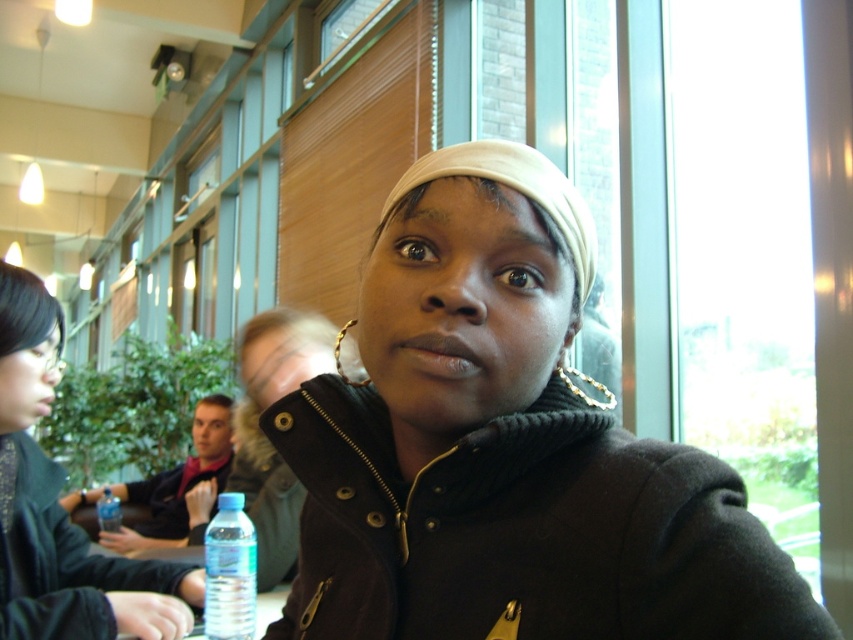
Question: Can you confirm if blue plastic water bottle at lower left is thinner than transparent plastic bottle at lower left?

Choices:
 (A) no
 (B) yes

Answer: (A)

Question: Which point is farther from the camera taking this photo?

Choices:
 (A) (30, 276)
 (B) (102, 518)

Answer: (B)

Question: Considering the relative positions of matte black jacket at upper left and transparent plastic bottle at lower left in the image provided, where is matte black jacket at upper left located with respect to transparent plastic bottle at lower left?

Choices:
 (A) left
 (B) right

Answer: (B)

Question: Which point is closer to the camera?

Choices:
 (A) matte black jacket at upper left
 (B) transparent plastic bottle at lower left

Answer: (A)

Question: Which of the following is the farthest from the observer?

Choices:
 (A) blue plastic water bottle at lower left
 (B) transparent plastic bottle at lower center
 (C) black woolen coat at center

Answer: (A)

Question: Is the position of black woolen coat at center less distant than that of matte black jacket at upper left?

Choices:
 (A) no
 (B) yes

Answer: (B)